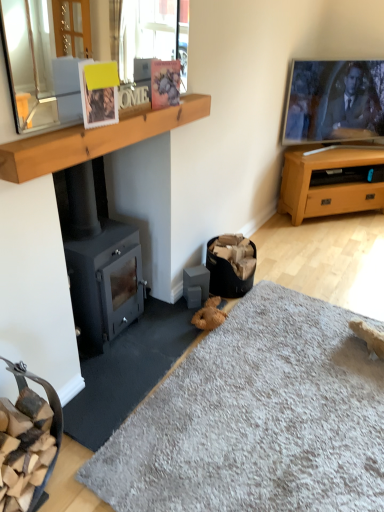
Question: Is wooden at upper center far away from clear glass mirror at upper left?

Choices:
 (A) yes
 (B) no

Answer: (B)

Question: From the image's perspective, is wooden at upper center on clear glass mirror at upper left?

Choices:
 (A) yes
 (B) no

Answer: (B)

Question: Does wooden at upper center have a larger size compared to clear glass mirror at upper left?

Choices:
 (A) no
 (B) yes

Answer: (B)

Question: From the image's perspective, is wooden at upper center beneath clear glass mirror at upper left?

Choices:
 (A) yes
 (B) no

Answer: (A)

Question: From a real-world perspective, is wooden at upper center over clear glass mirror at upper left?

Choices:
 (A) yes
 (B) no

Answer: (B)

Question: Is wooden at upper center looking in the opposite direction of clear glass mirror at upper left?

Choices:
 (A) no
 (B) yes

Answer: (A)

Question: Is clear glass mirror at upper left facing towards light brown wood tv stand at right?

Choices:
 (A) yes
 (B) no

Answer: (B)

Question: Does clear glass mirror at upper left have a lesser width compared to light brown wood tv stand at right?

Choices:
 (A) yes
 (B) no

Answer: (A)

Question: Is clear glass mirror at upper left shorter than light brown wood tv stand at right?

Choices:
 (A) no
 (B) yes

Answer: (B)

Question: Considering the relative sizes of clear glass mirror at upper left and light brown wood tv stand at right in the image provided, is clear glass mirror at upper left wider than light brown wood tv stand at right?

Choices:
 (A) yes
 (B) no

Answer: (B)

Question: Is clear glass mirror at upper left smaller than light brown wood tv stand at right?

Choices:
 (A) yes
 (B) no

Answer: (A)

Question: Does clear glass mirror at upper left lie behind light brown wood tv stand at right?

Choices:
 (A) yes
 (B) no

Answer: (B)

Question: Is soft gray carpet at lower center facing away from matte plastic picture frame at upper center, the 2th picture frame when ordered from front to back?

Choices:
 (A) yes
 (B) no

Answer: (B)